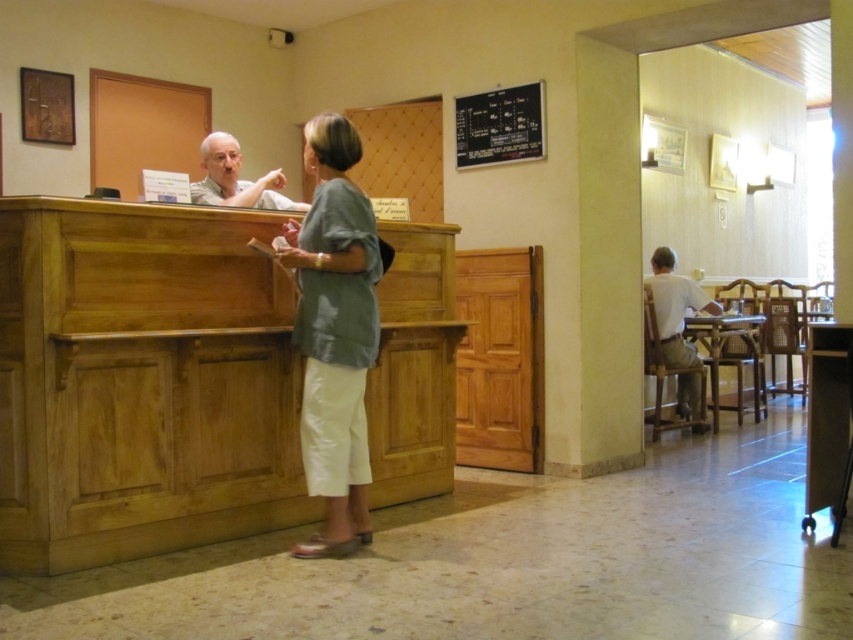
You are standing at the entrance of the hotel lobby and see the light green fabric blouse at center and the blackboard at upper center. Which object is nearer to you?

The light green fabric blouse at center is closer to the viewer than the blackboard at upper center.

You are standing at the camera position in the hotel lobby. There is a point marked at coordinates (x=352, y=442). Can you reach that point without moving past the reception desk?

The point at (x=352, y=442) is 10.48 feet away from the camera. Since the reception desk is in the foreground between you and the point, you would need to move around or past it to reach the point. However, the distance alone doesn not confirm if the desk obstructs the path. Without knowing the desk dimensions, we can only state the distance.